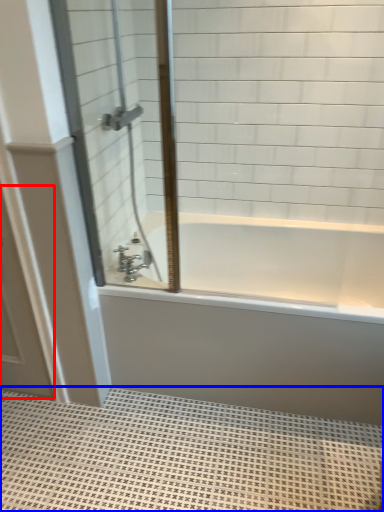
Question: Which object is closer to the camera taking this photo, screen door (highlighted by a red box) or bath mat (highlighted by a blue box)?

Choices:
 (A) screen door
 (B) bath mat

Answer: (B)